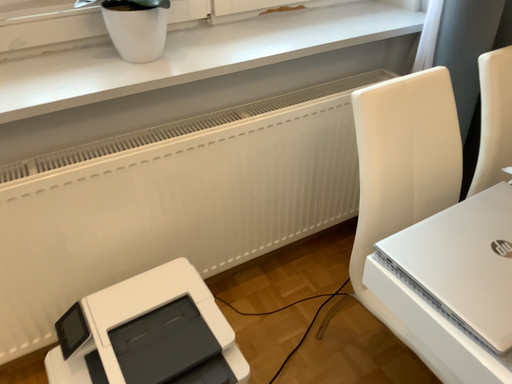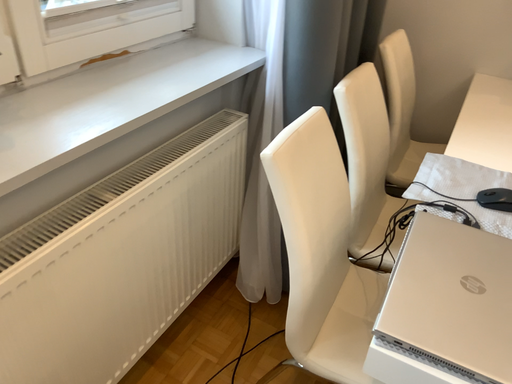
Question: How did the camera likely rotate when shooting the video?

Choices:
 (A) rotated upward
 (B) rotated downward

Answer: (A)